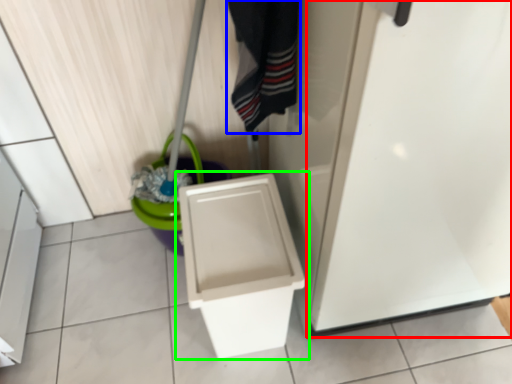
Question: Estimate the real-world distances between objects in this image. Which object is closer to screen door (highlighted by a red box), clothing (highlighted by a blue box) or toilet (highlighted by a green box)?

Choices:
 (A) clothing
 (B) toilet

Answer: (B)